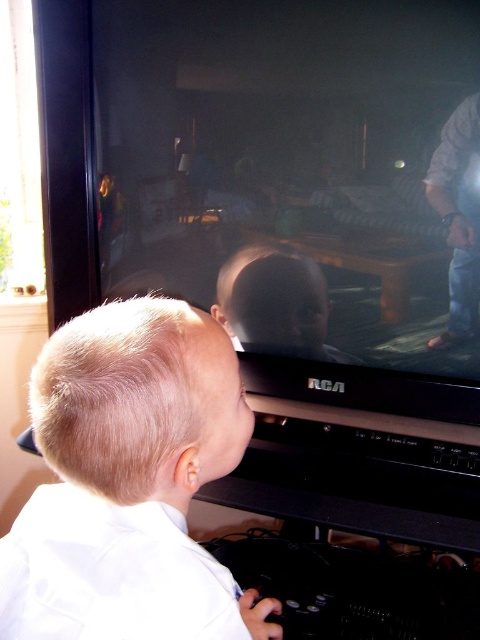
You are a photographer trying to capture the reflection on the TV screen. To ensure the reflection of the blonde hair boy at lower left is centered in the photo, where should you position the camera relative to the TV screen?

The reflection of the blonde hair boy at lower left on the TV screen is centered at point (132, 470), so you should position the camera directly in line with that coordinate to center the reflection.

You are a photographer trying to capture a photo of the smooth plastic baby at center without including the blonde hair boy at lower left in the frame. Based on their positions, is this possible?

The blonde hair boy at lower left is to the left of the smooth plastic baby at center, so if you position your camera to the right side of the baby, you can exclude the boy from the frame.